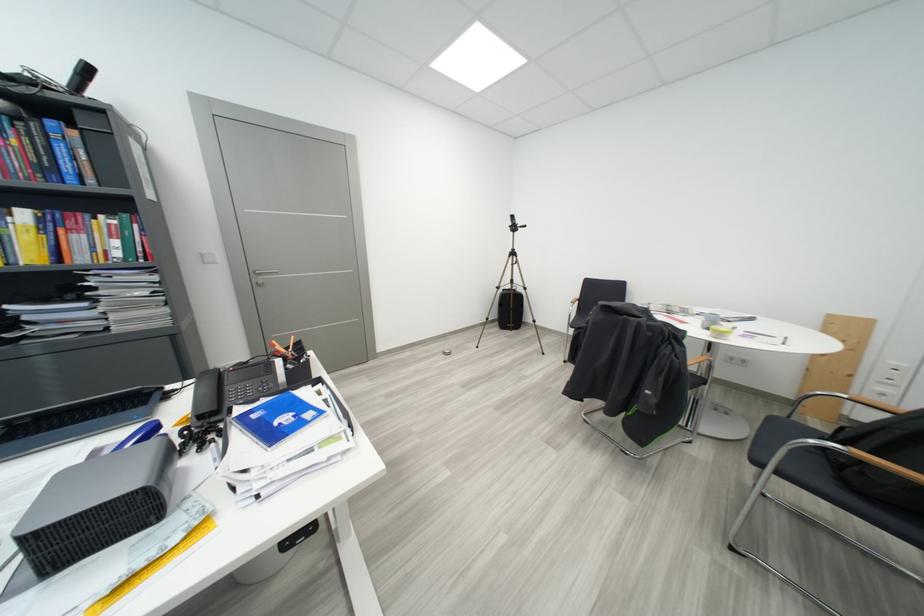
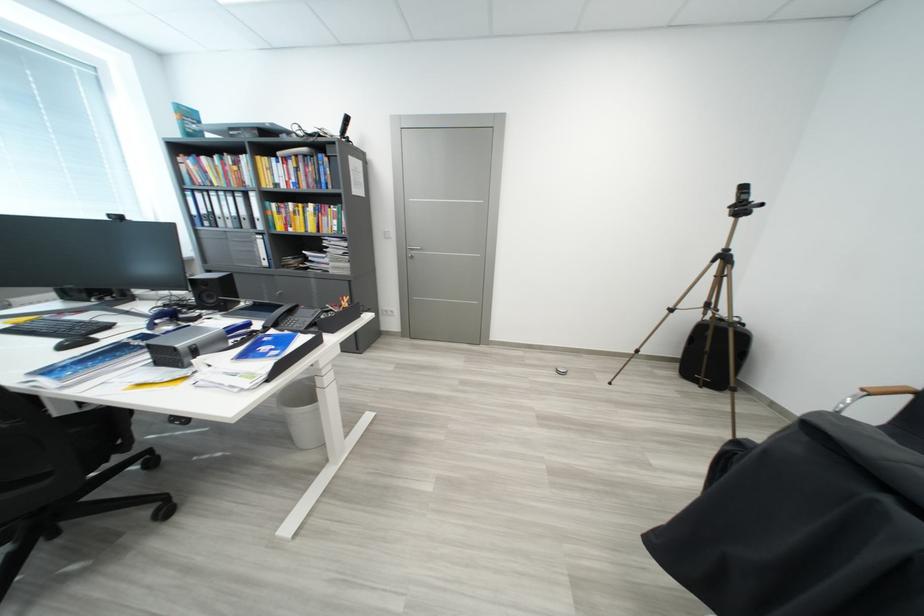
Question: The camera is either moving clockwise (left) or counter-clockwise (right) around the object. The first image is from the beginning of the video and the second image is from the end. Is the camera moving left or right when shooting the video?

Choices:
 (A) Left
 (B) Right

Answer: (B)